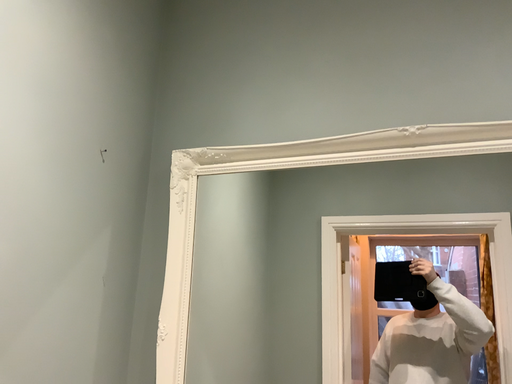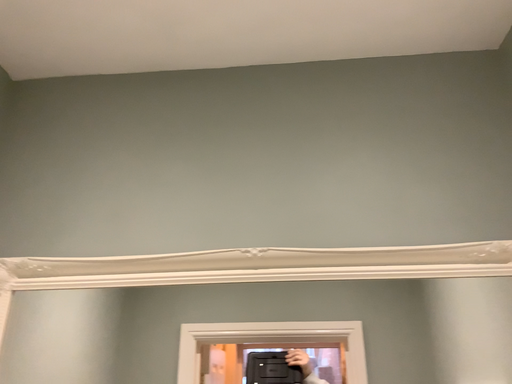
Question: Which way did the camera rotate in the video?

Choices:
 (A) rotated left
 (B) rotated right

Answer: (B)